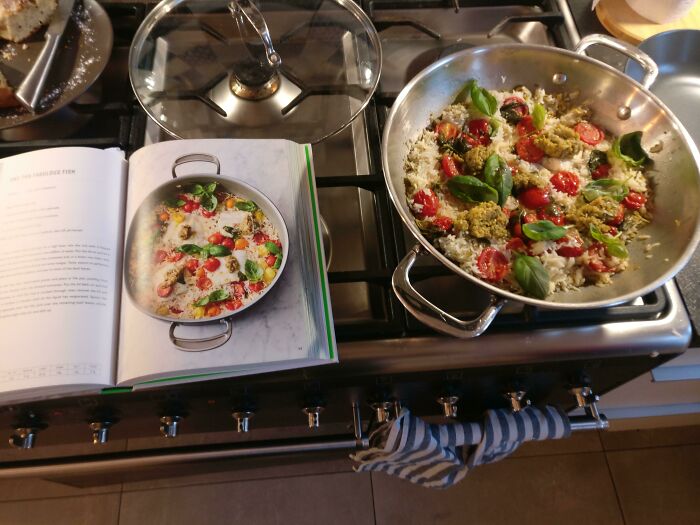
Find the location of a particular element. knob is located at coordinates (22, 440), (97, 434), (168, 430), (239, 425), (382, 414), (449, 410), (517, 400), (582, 398).